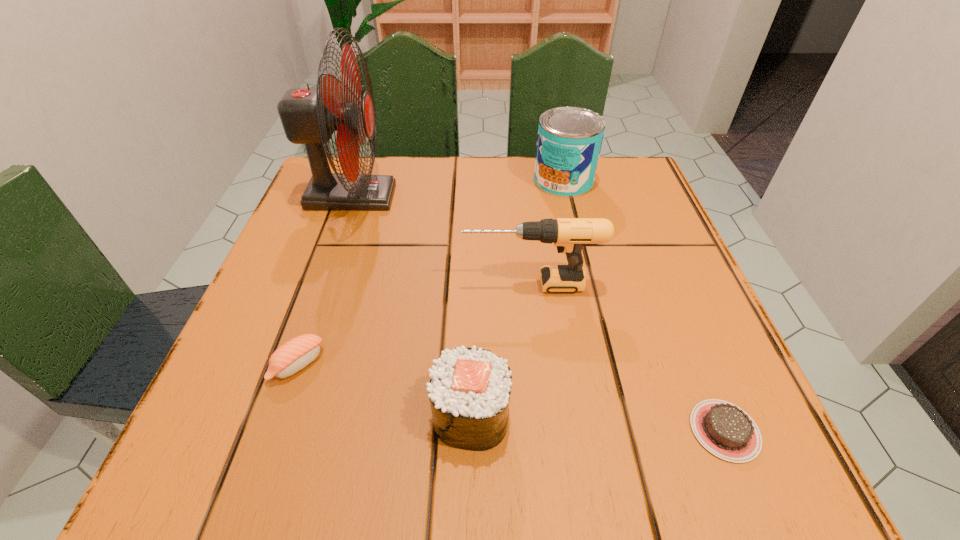
Locate an element on the screen. fan is located at coordinates (309, 116).

I want to click on can, so click(x=569, y=141).

Where is `drill`? The height and width of the screenshot is (540, 960). drill is located at coordinates click(569, 235).

This screenshot has width=960, height=540. I want to click on the fourth tallest object, so click(x=469, y=391).

In order to click on the right sushi in this screenshot , I will do `click(469, 391)`.

The height and width of the screenshot is (540, 960). In order to click on the fifth tallest object in this screenshot , I will do `click(294, 355)`.

At what (x,y) coordinates should I click in order to perform the action: click on the shorter sushi. Please return your answer as a coordinate pair (x, y). Image resolution: width=960 pixels, height=540 pixels. Looking at the image, I should click on (294, 355).

Where is `the rightmost object`? The width and height of the screenshot is (960, 540). the rightmost object is located at coordinates (724, 429).

Find the location of `chocolate cake`. chocolate cake is located at coordinates (724, 429).

Find the location of a particular element. The width and height of the screenshot is (960, 540). vacant space located 0.210m on the front-facing side of the fan is located at coordinates (492, 197).